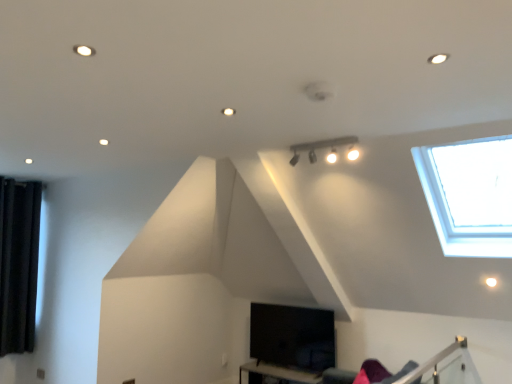
The height and width of the screenshot is (384, 512). Describe the element at coordinates (276, 374) in the screenshot. I see `black matte table at lower center` at that location.

This screenshot has height=384, width=512. Identify the location of matte black track lighting at upper center. (x=319, y=147).

Measure the distance from black matte table at lower center to matte black track lighting at upper center.

A distance of 2.43 meters exists between black matte table at lower center and matte black track lighting at upper center.

From a real-world perspective, is black matte table at lower center on matte black track lighting at upper center?

Actually, black matte table at lower center is physically below matte black track lighting at upper center in the real world.

From the image's perspective, is black matte table at lower center on top of matte black track lighting at upper center?

Actually, black matte table at lower center appears below matte black track lighting at upper center in the image.

Considering the relative sizes of black matte table at lower center and matte black track lighting at upper center in the image provided, is black matte table at lower center taller than matte black track lighting at upper center?

Correct, black matte table at lower center is much taller as matte black track lighting at upper center.

Identify the location of table in front of the black velvet curtain at left. (276, 374).

From a real-world perspective, which is physically above, black matte table at lower center or black velvet curtain at left?

From a 3D spatial view, black velvet curtain at left is above.

Considering the relative positions of black matte table at lower center and black velvet curtain at left in the image provided, is black matte table at lower center in front of black velvet curtain at left?

Yes, black matte table at lower center is closer to the viewer.

Is black matte table at lower center at the left side of black velvet curtain at left?

No.

In the image, is black velvet curtain at left on the left side or the right side of matte black track lighting at upper center?

black velvet curtain at left is positioned on matte black track lighting at upper center's left side.

Can you tell me how much black velvet curtain at left and matte black track lighting at upper center differ in facing direction?

black velvet curtain at left and matte black track lighting at upper center are facing 90.1 degrees away from each other.

Does black velvet curtain at left have a smaller size compared to matte black track lighting at upper center?

No.

At what (x,y) coordinates should I click in order to perform the action: click on curtain located below the matte black track lighting at upper center (from the image's perspective). Please return your answer as a coordinate pair (x, y). The image size is (512, 384). Looking at the image, I should click on (18, 263).

Is there a large distance between black velvet curtain at left and black matte table at lower center?

Yes, black velvet curtain at left is far from black matte table at lower center.

In terms of size, does black velvet curtain at left appear bigger or smaller than black matte table at lower center?

Considering their sizes, black velvet curtain at left takes up less space than black matte table at lower center.

Does black velvet curtain at left contain black matte table at lower center?

No, black matte table at lower center is located outside of black velvet curtain at left.

Is black velvet curtain at left at the right side of black matte table at lower center?

Incorrect, black velvet curtain at left is not on the right side of black matte table at lower center.

Which is in front, matte black track lighting at upper center or black velvet curtain at left?

matte black track lighting at upper center is closer to the camera.

In order to click on lamp located above the black velvet curtain at left (from a real-world perspective) in this screenshot , I will do `click(319, 147)`.

From a real-world perspective, does matte black track lighting at upper center stand above black velvet curtain at left?

Indeed, from a real-world perspective, matte black track lighting at upper center stands above black velvet curtain at left.

From the image's perspective, is matte black track lighting at upper center above black velvet curtain at left?

Yes, from the image's perspective, matte black track lighting at upper center is on top of black velvet curtain at left.

Is matte black track lighting at upper center positioned far away from black matte table at lower center?

Yes.

In terms of size, does matte black track lighting at upper center appear bigger or smaller than black matte table at lower center?

matte black track lighting at upper center is smaller than black matte table at lower center.

From a real-world perspective, is matte black track lighting at upper center above or below black matte table at lower center?

matte black track lighting at upper center is situated higher than black matte table at lower center in the real world.

Which of these two, matte black track lighting at upper center or black matte table at lower center, is thinner?

Thinner between the two is matte black track lighting at upper center.

You are a GUI agent. You are given a task and a screenshot of the screen. Output one action in this format:
    pyautogui.click(x=<x>, y=<y>)
    Task: Click on the lamp that appears above the black matte table at lower center (from a real-world perspective)
    Image resolution: width=512 pixels, height=384 pixels.
    Given the screenshot: What is the action you would take?
    pyautogui.click(x=319, y=147)

You are a GUI agent. You are given a task and a screenshot of the screen. Output one action in this format:
    pyautogui.click(x=<x>, y=<y>)
    Task: Click on the curtain behind the black matte table at lower center
    
    Given the screenshot: What is the action you would take?
    pyautogui.click(x=18, y=263)

In the scene shown: Which object lies further to the anchor point black matte table at lower center, black velvet curtain at left or matte black track lighting at upper center?

black velvet curtain at left.

Which object lies nearer to the anchor point matte black track lighting at upper center, black velvet curtain at left or black matte table at lower center?

black matte table at lower center is closer to matte black track lighting at upper center.

Considering their positions, is matte black track lighting at upper center positioned closer to black matte table at lower center than black velvet curtain at left?

The object closer to black matte table at lower center is matte black track lighting at upper center.

When comparing their distances from black velvet curtain at left, does black matte table at lower center or matte black track lighting at upper center seem further?

Among the two, matte black track lighting at upper center is located further to black velvet curtain at left.

Which object lies further to the anchor point black velvet curtain at left, matte black track lighting at upper center or black matte table at lower center?

Based on the image, matte black track lighting at upper center appears to be further to black velvet curtain at left.

In the scene shown: From the image, which object appears to be farther from matte black track lighting at upper center, black matte table at lower center or black velvet curtain at left?

The object further to matte black track lighting at upper center is black velvet curtain at left.

The image size is (512, 384). Find the location of `table between black velvet curtain at left and matte black track lighting at upper center from left to right`. table between black velvet curtain at left and matte black track lighting at upper center from left to right is located at coordinates click(276, 374).